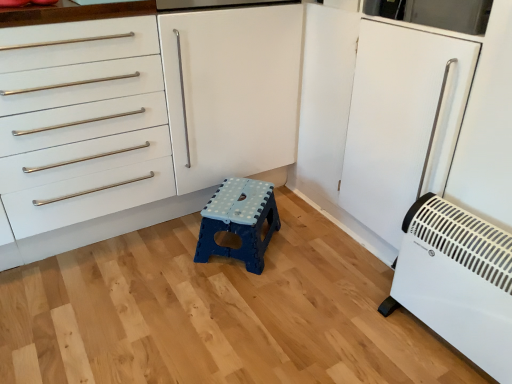
Locate an element on the screen. vacant area that lies to the right of blue plastic stool at center is located at coordinates (308, 251).